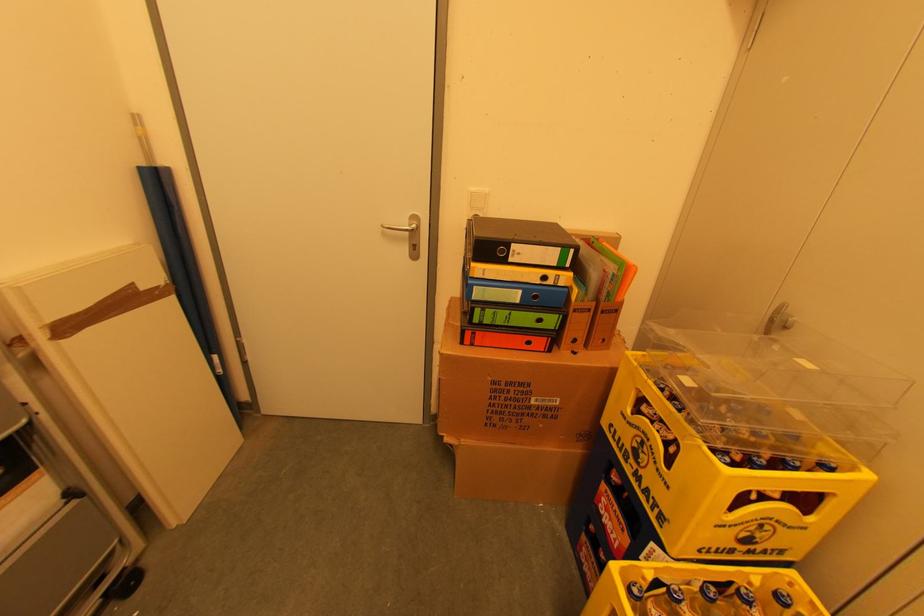
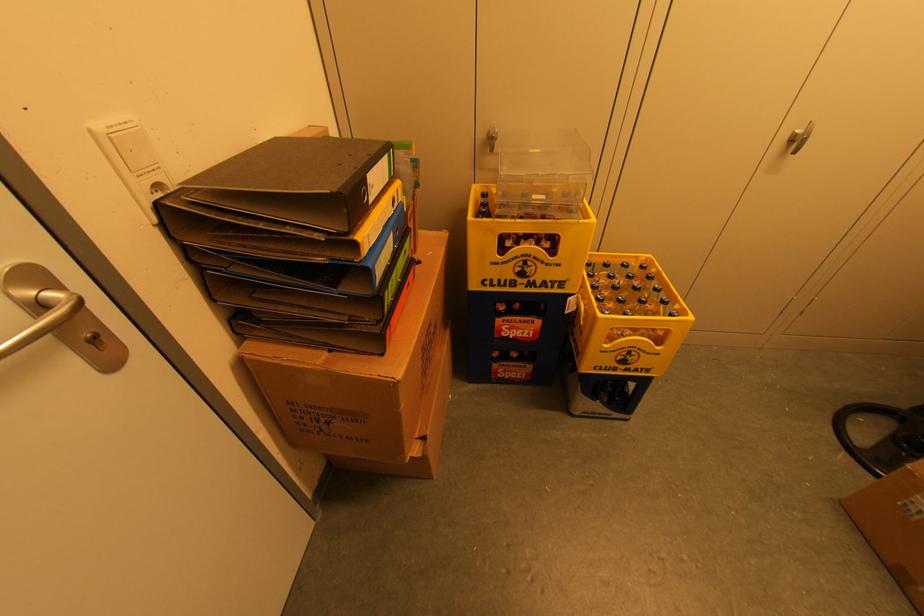
Locate, in the second image, the point that corresponds to point 517,252 in the first image.

(371, 185)